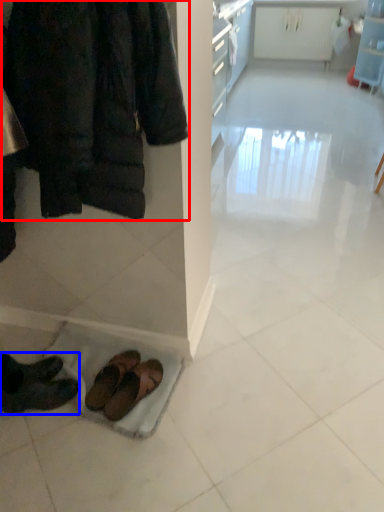
Question: Which point is closer to the camera, jacket (highlighted by a red box) or footwear (highlighted by a blue box)?

Choices:
 (A) jacket
 (B) footwear

Answer: (A)